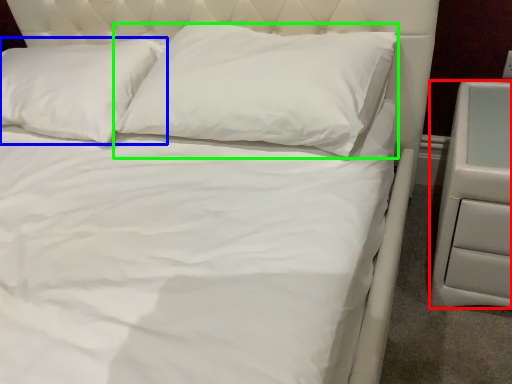
Question: Which object is the closest to the nightstand (highlighted by a red box)? Choose among these: pillow (highlighted by a blue box) or pillow (highlighted by a green box).

Choices:
 (A) pillow
 (B) pillow

Answer: (B)